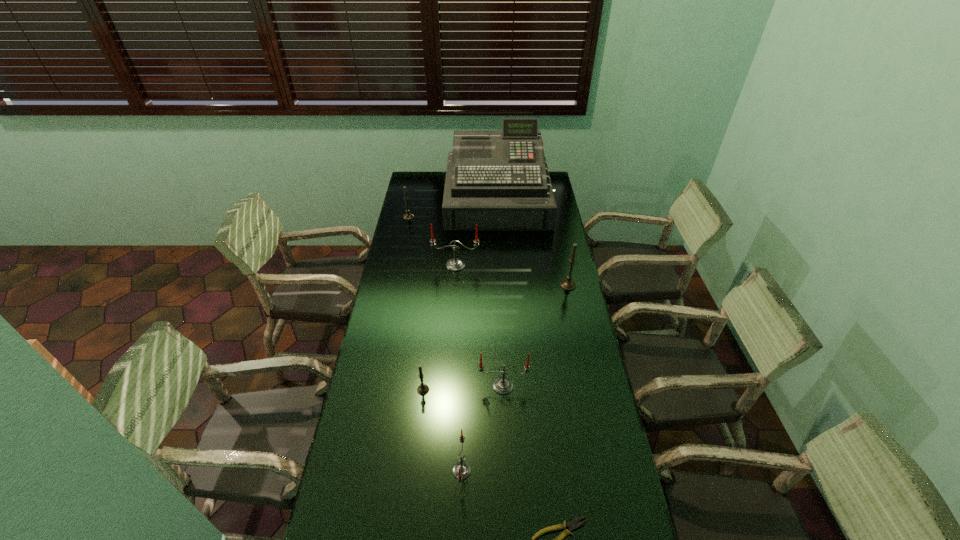
The image size is (960, 540). Identify the location of free space between the second farthest red candle and the fifth nearest object. 536,336.

At what (x,y) coordinates should I click in order to perform the action: click on vacant space that's between the tallest object and the fourth farthest object. Please return your answer as a coordinate pair (x, y). The image size is (960, 540). Looking at the image, I should click on (533, 242).

Identify the location of object that is the third closest to the fourth farthest object. pyautogui.click(x=502, y=385).

Locate which object ranks sixth in proximity to the second nearest object. Please provide its 2D coordinates. Your answer should be formatted as a tuple, i.e. [(x, y)], where the tuple contains the x and y coordinates of a point satisfying the conditions above.

[(498, 179)]

In order to click on the fourth closest candle to the seventh farthest object in this screenshot , I will do `click(455, 264)`.

Where is `candle identified as the closest to the tallest object`? The height and width of the screenshot is (540, 960). candle identified as the closest to the tallest object is located at coordinates (408, 216).

Select which red candle appears as the second closest to the second biggest red candle. Please provide its 2D coordinates. Your answer should be formatted as a tuple, i.e. [(x, y)], where the tuple contains the x and y coordinates of a point satisfying the conditions above.

[(455, 264)]

This screenshot has width=960, height=540. I want to click on red candle object that ranks as the second closest to the second nearest red candle, so click(x=455, y=264).

Find the location of a particular element. The height and width of the screenshot is (540, 960). gray candle that is the closest to the second smallest red candle is located at coordinates (423, 389).

This screenshot has width=960, height=540. Identify the location of gray candle that is the third closest to the nearest object. (408, 216).